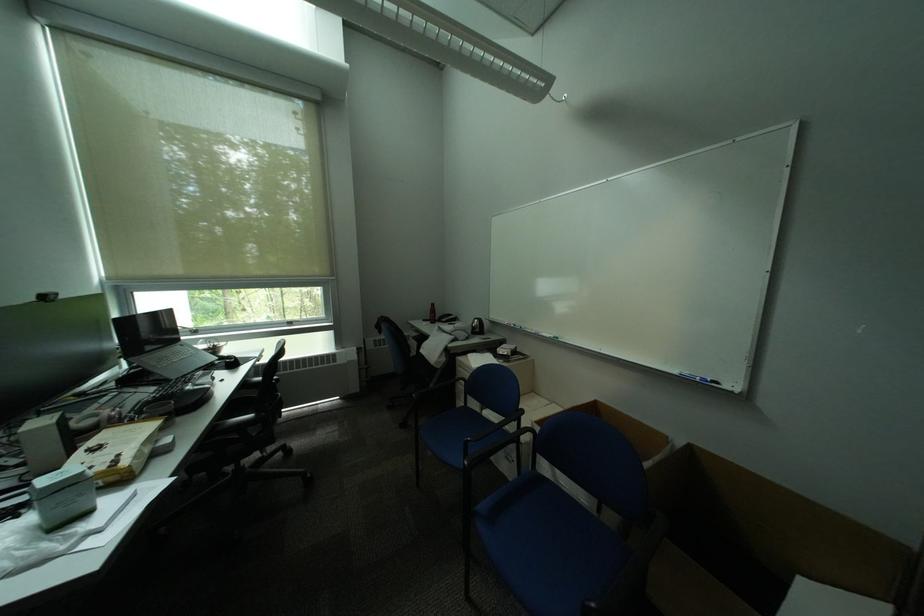
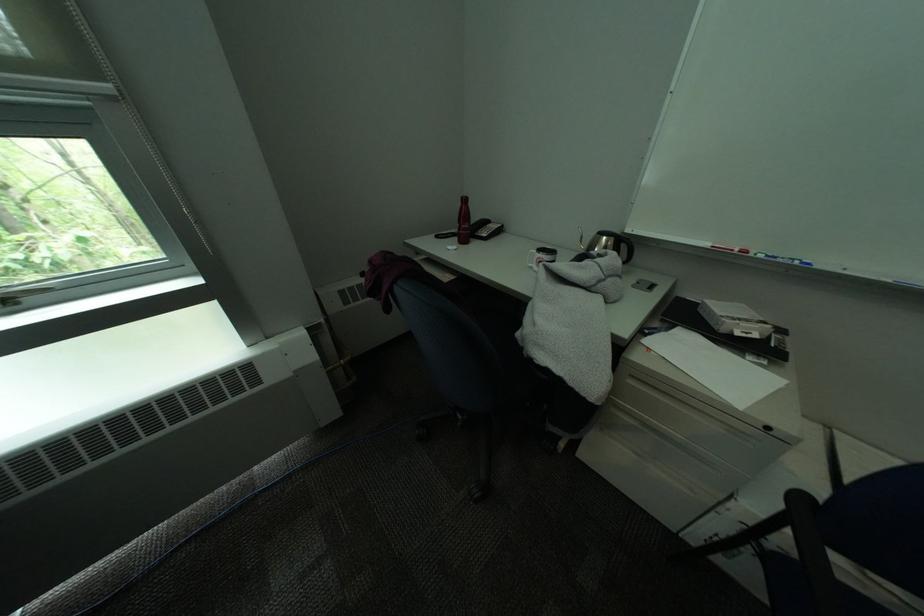
Find the pixel in the second image that matches [441,323] in the first image.

(466, 241)